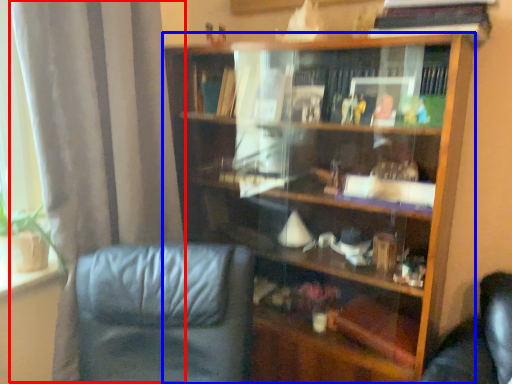
Question: Which object appears closest to the camera in this image, curtain (highlighted by a red box) or bookcase (highlighted by a blue box)?

Choices:
 (A) curtain
 (B) bookcase

Answer: (A)